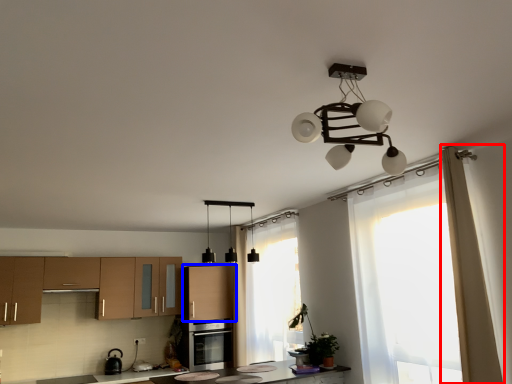
Question: Which object is closer to the camera taking this photo, curtain (highlighted by a red box) or cabinetry (highlighted by a blue box)?

Choices:
 (A) curtain
 (B) cabinetry

Answer: (A)